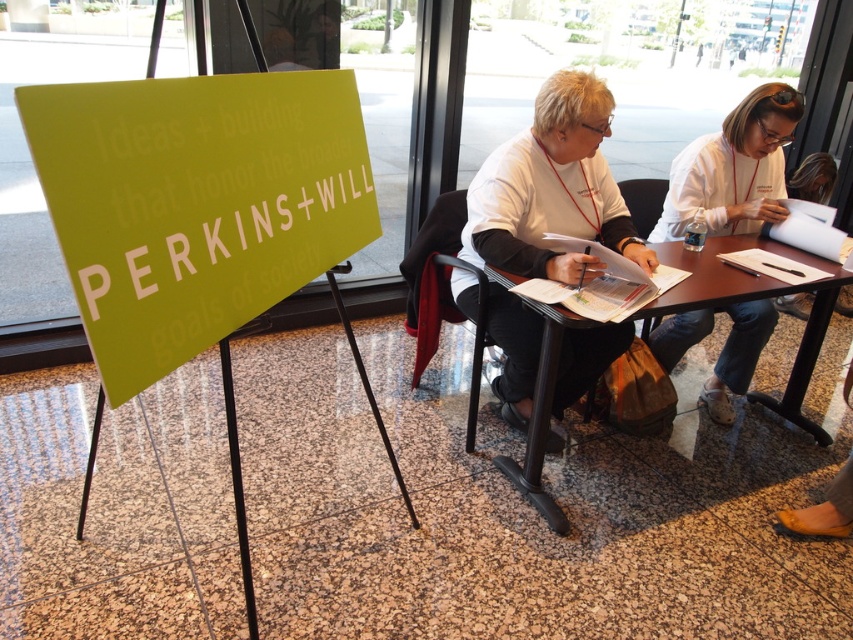
You are standing in the conference room and see two points marked on the floor. The first point is at coordinate point [132,157] and the second is at coordinate point [688,342]. If you are facing the green sign with the text

The point at coordinate point [132,157] is in front of point [688,342], so it is closer to you.

You are a photographer setting up for a group photo in the conference room. You notice the white matte shirt at center and the black plastic chair at center. Which object is wider when viewed from the front?

The white matte shirt at center is wider than the black plastic chair at center according to the description.

You are standing in the conference room and want to take a photo of the green matte sign at left. If your camera has a minimum focusing distance of 40 inches, will you need to move closer or farther away to ensure the sign is in focus?

The green matte sign at left is 38.71 inches away from the camera. Since the minimum focusing distance is 40 inches, you need to move farther away from the sign to ensure it is in focus.